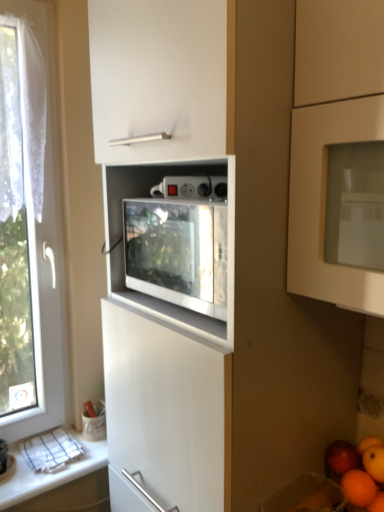
At what (x,y) coordinates should I click in order to perform the action: click on free space above white glossy countertop at lower left (from a real-world perspective). Please return your answer as a coordinate pair (x, y). Looking at the image, I should click on (56, 461).